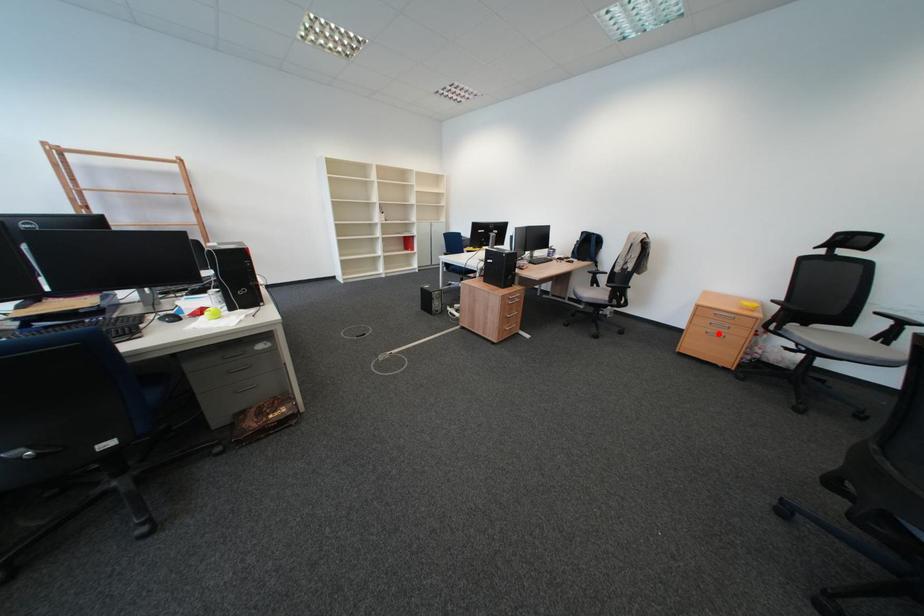
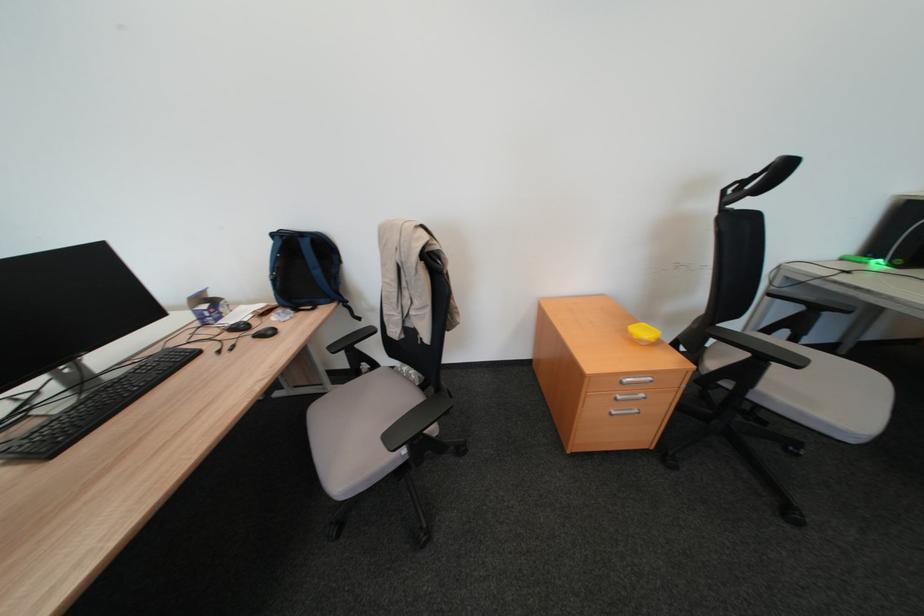
Question: I am providing you with two images of the same scene from different viewpoints. Given a red point in image1, look at the same physical point in image2. Is it:

Choices:
 (A) Closer to the viewpoint
 (B) Farther from the viewpoint

Answer: (B)